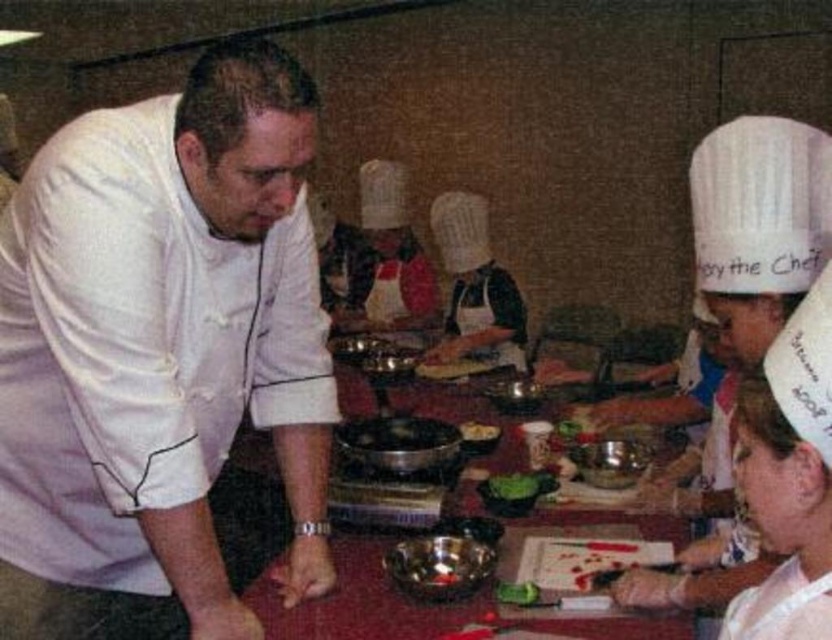
Consider the image. Between smooth brown bread at center and yellow matte cookie at center, which one has less height?

With less height is yellow matte cookie at center.

From the picture: Is smooth brown bread at center to the left of yellow matte cookie at center from the viewer's perspective?

Yes, smooth brown bread at center is to the left of yellow matte cookie at center.

From the picture: Who is more distant from viewer, (429, 376) or (461, 432)?

Positioned behind is point (429, 376).

What are the coordinates of `smooth brown bread at center` in the screenshot? It's located at (451, 369).

Is point (296, 401) farther from viewer compared to point (499, 428)?

No.

Which is more to the right, white matte chef coat at left or yellow matte cookie at center?

Positioned to the right is yellow matte cookie at center.

You are a GUI agent. You are given a task and a screenshot of the screen. Output one action in this format:
    pyautogui.click(x=<x>, y=<y>)
    Task: Click on the white matte chef coat at left
    
    Given the screenshot: What is the action you would take?
    pyautogui.click(x=161, y=356)

In order to click on white matte chef coat at left in this screenshot , I will do `click(161, 356)`.

Does white matte chef coat at left appear over metallic bowls at center?

Yes.

Is point (78, 445) positioned behind point (375, 593)?

That is False.

Where is `white matte chef coat at left`? white matte chef coat at left is located at coordinates (161, 356).